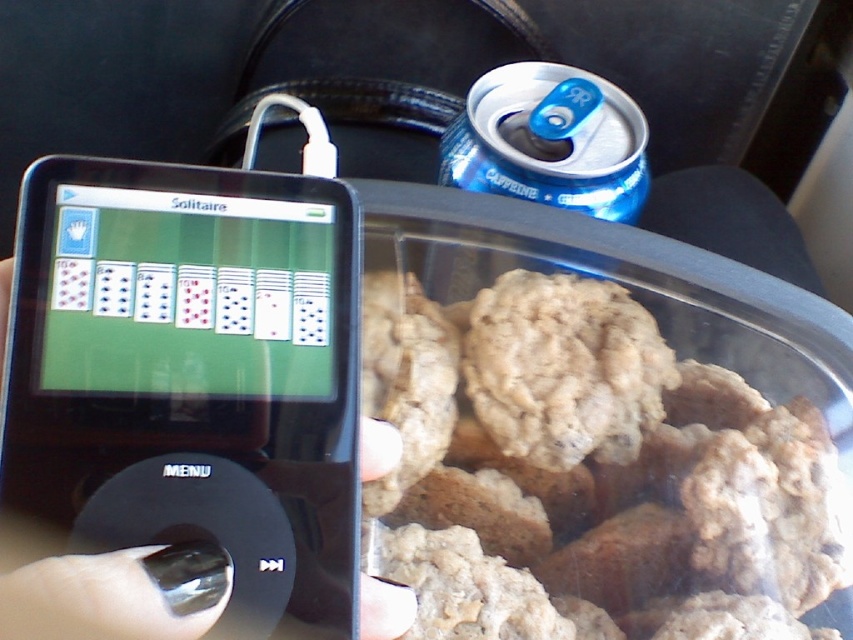
Question: Which point appears closest to the camera in this image?

Choices:
 (A) (602, 106)
 (B) (45, 401)

Answer: (B)

Question: Is baked oatmeal cookies at lower right bigger than blue metallic can at upper right?

Choices:
 (A) no
 (B) yes

Answer: (B)

Question: Estimate the real-world distances between objects in this image. Which object is closer to the baked oatmeal cookies at lower right?

Choices:
 (A) black glossy ipod at left
 (B) blue metallic can at upper right

Answer: (B)

Question: Which point is closer to the camera taking this photo?

Choices:
 (A) coord(509,568)
 (B) coord(314,508)
 (C) coord(606,131)

Answer: (B)

Question: Can you confirm if baked oatmeal cookies at lower right is wider than blue metallic can at upper right?

Choices:
 (A) yes
 (B) no

Answer: (A)

Question: Is the position of black glossy ipod at left less distant than that of blue metallic can at upper right?

Choices:
 (A) yes
 (B) no

Answer: (A)